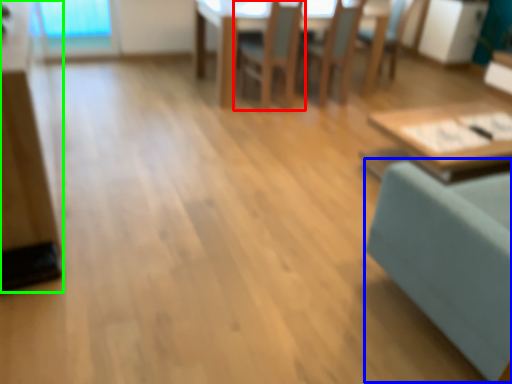
Question: Estimate the real-world distances between objects in this image. Which object is closer to chair (highlighted by a red box), swivel chair (highlighted by a blue box) or dresser (highlighted by a green box)?

Choices:
 (A) swivel chair
 (B) dresser

Answer: (B)